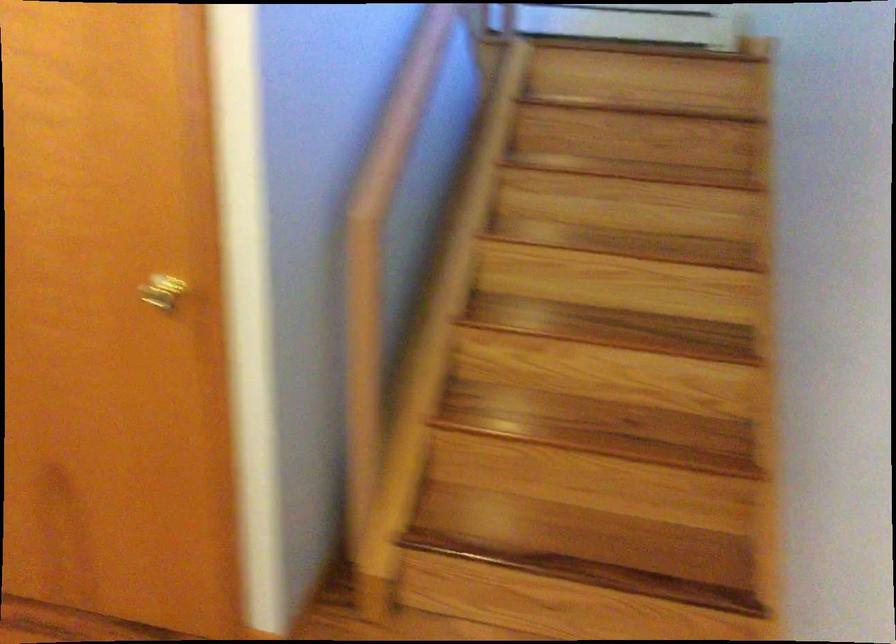
Where is `gold doorknob`? The image size is (896, 644). gold doorknob is located at coordinates (161, 290).